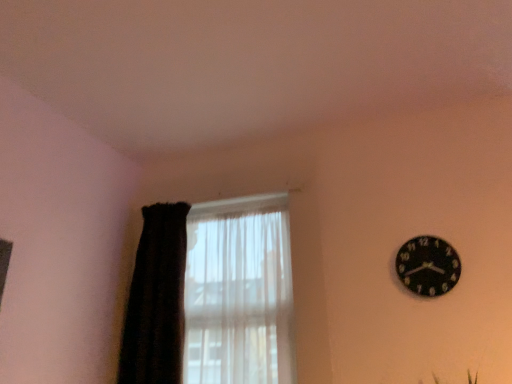
Question: Is translucent fabric at left smaller than black matte clock at upper right?

Choices:
 (A) yes
 (B) no

Answer: (B)

Question: From the image's perspective, is translucent fabric at left under black matte clock at upper right?

Choices:
 (A) yes
 (B) no

Answer: (A)

Question: Considering the relative positions of translucent fabric at left and black matte clock at upper right in the image provided, is translucent fabric at left to the right of black matte clock at upper right from the viewer's perspective?

Choices:
 (A) yes
 (B) no

Answer: (B)

Question: From a real-world perspective, is translucent fabric at left physically above black matte clock at upper right?

Choices:
 (A) yes
 (B) no

Answer: (B)

Question: Is the depth of translucent fabric at left less than that of black matte clock at upper right?

Choices:
 (A) no
 (B) yes

Answer: (A)

Question: Does point (404, 286) appear closer or farther from the camera than point (168, 263)?

Choices:
 (A) farther
 (B) closer

Answer: (B)

Question: Considering the positions of black matte clock at upper right and black fuzzy curtain at left in the image, is black matte clock at upper right bigger or smaller than black fuzzy curtain at left?

Choices:
 (A) small
 (B) big

Answer: (A)

Question: Considering their positions, is black matte clock at upper right located in front of or behind black fuzzy curtain at left?

Choices:
 (A) behind
 (B) front

Answer: (B)

Question: Is black matte clock at upper right situated inside black fuzzy curtain at left or outside?

Choices:
 (A) inside
 (B) outside

Answer: (B)

Question: Visually, is black fuzzy curtain at left positioned to the left or to the right of black matte clock at upper right?

Choices:
 (A) left
 (B) right

Answer: (A)

Question: Considering the positions of black fuzzy curtain at left and black matte clock at upper right in the image, is black fuzzy curtain at left bigger or smaller than black matte clock at upper right?

Choices:
 (A) small
 (B) big

Answer: (B)

Question: From a real-world perspective, is black fuzzy curtain at left physically located above or below black matte clock at upper right?

Choices:
 (A) below
 (B) above

Answer: (A)

Question: From their relative heights in the image, would you say black fuzzy curtain at left is taller or shorter than black matte clock at upper right?

Choices:
 (A) short
 (B) tall

Answer: (B)

Question: Is translucent fabric at left inside the boundaries of black fuzzy curtain at left, or outside?

Choices:
 (A) outside
 (B) inside

Answer: (B)

Question: From the image's perspective, is translucent fabric at left above or below black fuzzy curtain at left?

Choices:
 (A) above
 (B) below

Answer: (B)